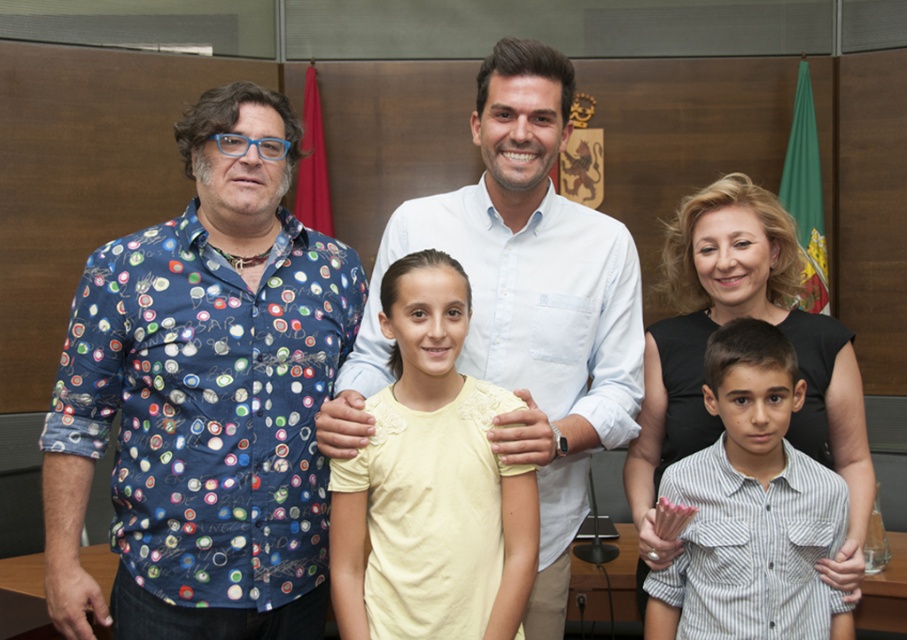
Question: Can you confirm if white cotton shirt at center is positioned above yellow cotton shirt at center?

Choices:
 (A) no
 (B) yes

Answer: (B)

Question: Among these objects, which one is nearest to the camera?

Choices:
 (A) white cotton shirt at center
 (B) yellow cotton shirt at center
 (C) striped cotton shirt at center

Answer: (B)

Question: Which point is farther to the camera?

Choices:
 (A) blue printed shirt at left
 (B) yellow cotton shirt at center
 (C) white cotton shirt at center

Answer: (A)

Question: Among these points, which one is farthest from the camera?

Choices:
 (A) (124, 616)
 (B) (450, 445)

Answer: (A)

Question: Can you confirm if blue printed shirt at left is positioned above yellow cotton shirt at center?

Choices:
 (A) yes
 (B) no

Answer: (A)

Question: Is white cotton shirt at center thinner than striped cotton shirt at center?

Choices:
 (A) no
 (B) yes

Answer: (A)